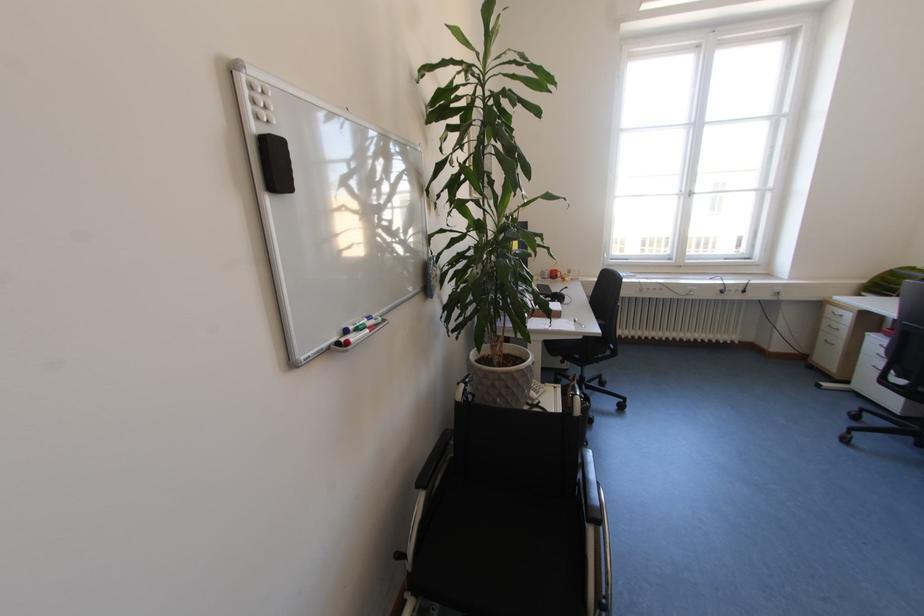
Find the location of a particular element. Image resolution: width=924 pixels, height=616 pixels. green whiteboard marker is located at coordinates (372, 323).